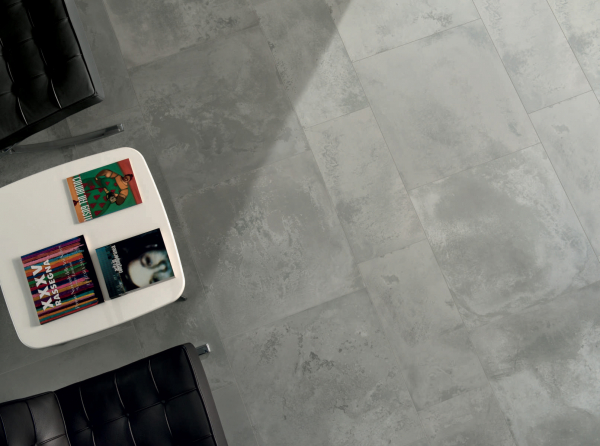
This screenshot has width=600, height=446. I want to click on grey tiles, so click(284, 307), click(478, 189).